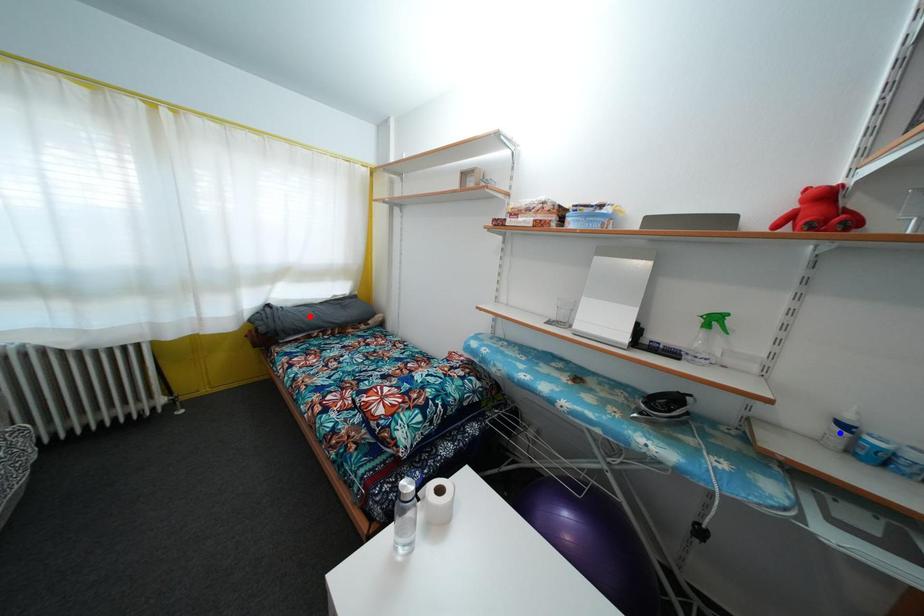
Question: Two points are marked on the image. Which point is closer to the camera?

Choices:
 (A) Blue point is closer.
 (B) Red point is closer.

Answer: (A)